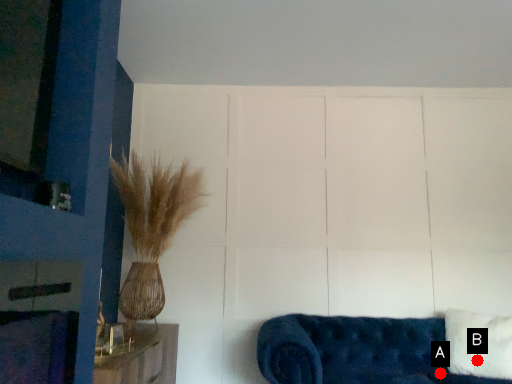
Question: Two points are circled on the image, labeled by A and B beside each circle. Which point is closer to the camera?

Choices:
 (A) A is closer
 (B) B is closer

Answer: (B)